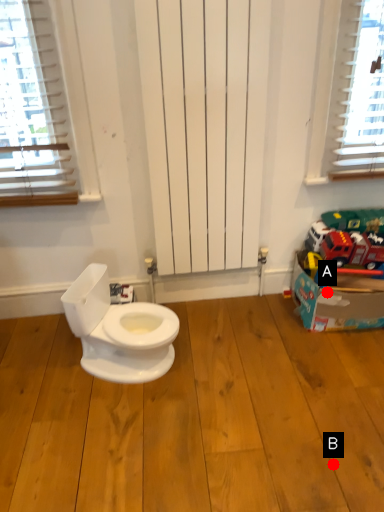
Question: Two points are circled on the image, labeled by A and B beside each circle. Which point is closer to the camera?

Choices:
 (A) A is closer
 (B) B is closer

Answer: (B)